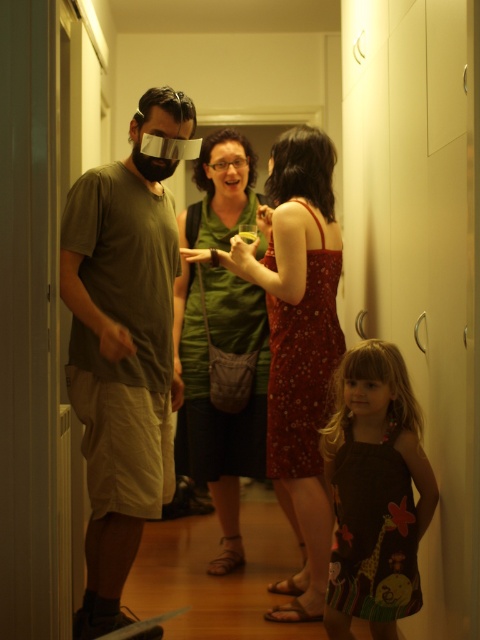
You are a photographer setting up a camera on a tripod in the hallway. The camera is positioned to capture both the floral fabric dress at center and the dark brown fabric dress at lower right. Given the distance between them, will the camera be able to capture both subjects in a single frame without moving the tripod?

Yes, the camera can capture both the floral fabric dress at center and the dark brown fabric dress at lower right in a single frame since the distance between them is 21.72 inches, which is within the camera lens field of view.